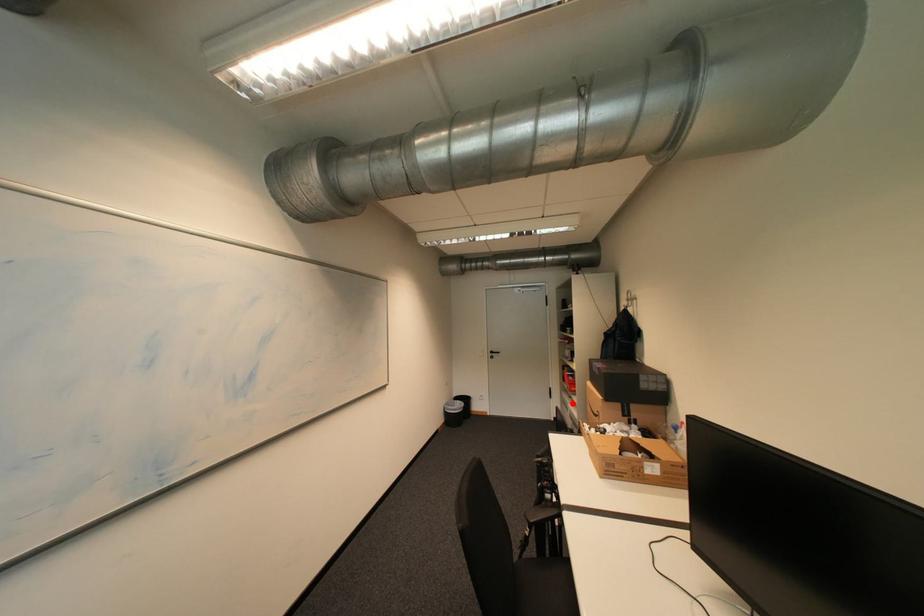
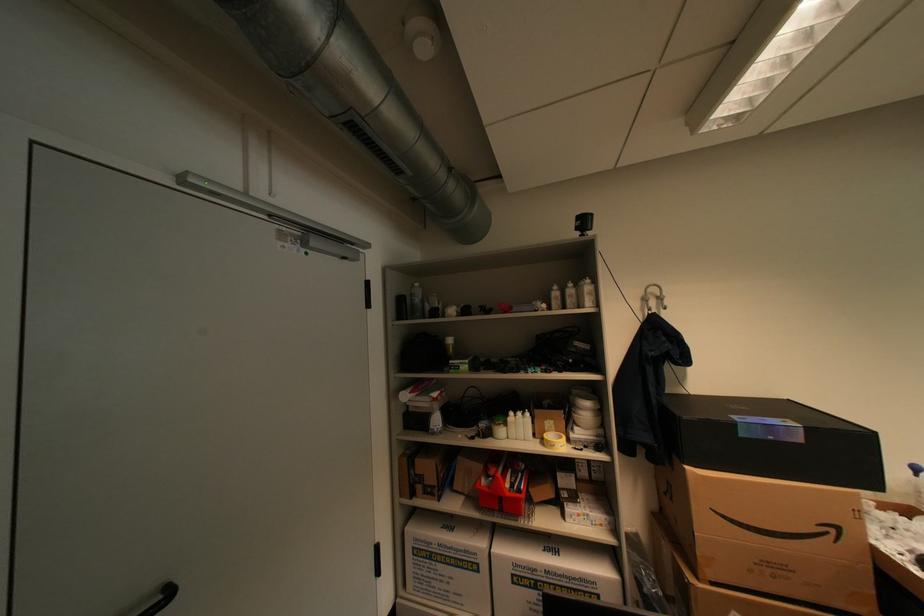
Find the pixel in the second image that matches the highlighted location in the first image.

(439, 556)